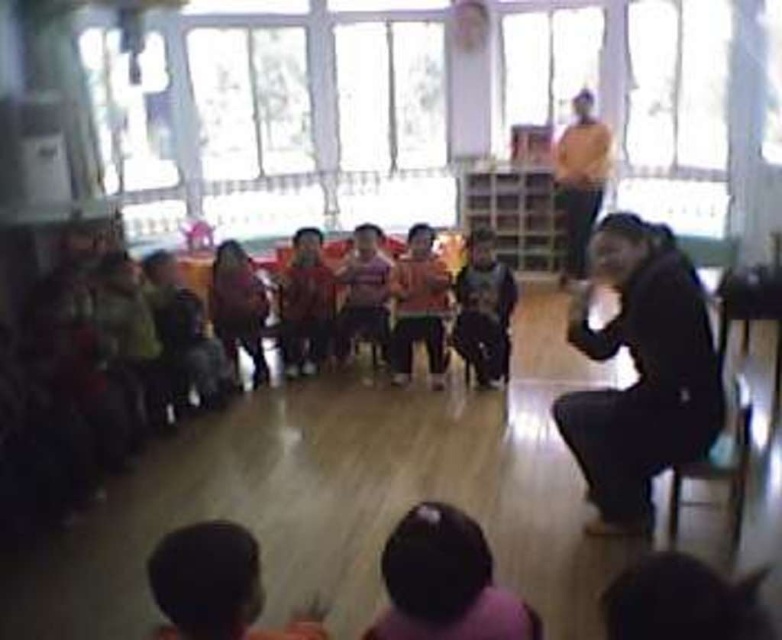
Question: Which object is positioned farthest from the matte red shirt at center?

Choices:
 (A) wooden chair at lower right
 (B) orange sweater at upper center

Answer: (A)

Question: Considering the relative positions of dark brown hair at lower left and dark gray sweater at center in the image provided, where is dark brown hair at lower left located with respect to dark gray sweater at center?

Choices:
 (A) below
 (B) above

Answer: (A)

Question: Which point appears closest to the camera in this image?

Choices:
 (A) (226, 545)
 (B) (569, 161)

Answer: (A)

Question: Which is farther from the matte red shirt at center?

Choices:
 (A) dark brown hair at lower left
 (B) matte pink shirt at center

Answer: (A)

Question: Is orange sweater at upper center smaller than matte pink sweater at center?

Choices:
 (A) yes
 (B) no

Answer: (B)

Question: Can you confirm if dark brown hair at lower left is bigger than wooden chair at lower right?

Choices:
 (A) no
 (B) yes

Answer: (B)